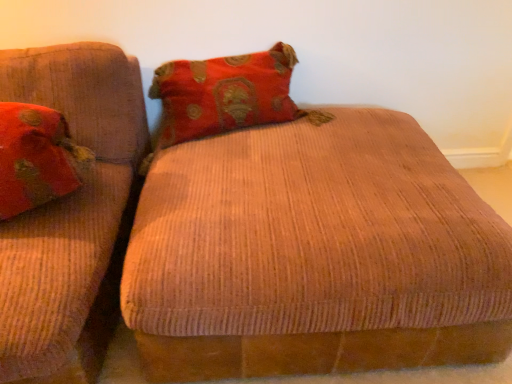
Question: Is point (348, 216) positioned closer to the camera than point (7, 183)?

Choices:
 (A) farther
 (B) closer

Answer: (A)

Question: Is corduroy fabric ottoman at center inside or outside of matte red pillow at left?

Choices:
 (A) outside
 (B) inside

Answer: (A)

Question: From a real-world perspective, is corduroy fabric ottoman at center above or below matte red pillow at left?

Choices:
 (A) below
 (B) above

Answer: (A)

Question: Is matte red pillow at left inside or outside of corduroy fabric ottoman at center?

Choices:
 (A) outside
 (B) inside

Answer: (A)

Question: Considering their positions, is matte red pillow at left located in front of or behind corduroy fabric ottoman at center?

Choices:
 (A) front
 (B) behind

Answer: (B)

Question: Is point (34, 205) positioned closer to the camera than point (462, 218)?

Choices:
 (A) farther
 (B) closer

Answer: (A)

Question: From the image's perspective, relative to corduroy fabric ottoman at center, is matte red pillow at left above or below?

Choices:
 (A) above
 (B) below

Answer: (A)